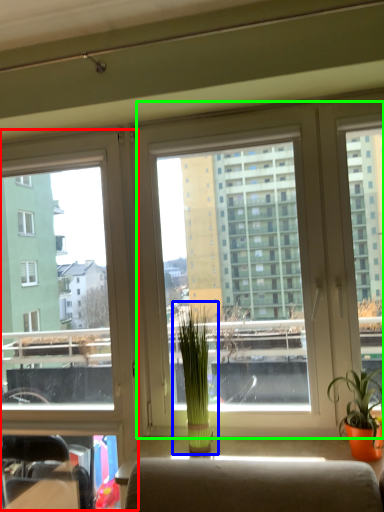
Question: Which object is positioned closest to window (highlighted by a red box)? Select from houseplant (highlighted by a blue box) and window screen (highlighted by a green box).

Choices:
 (A) houseplant
 (B) window screen

Answer: (B)